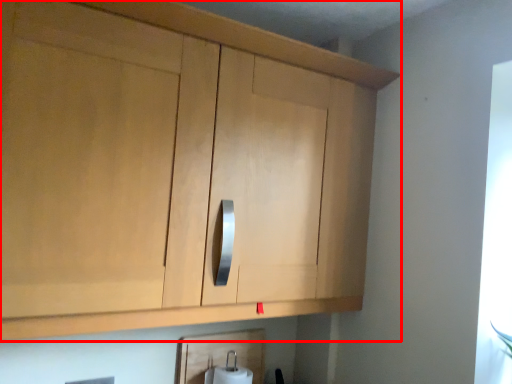
Question: From the image's perspective, considering the relative positions of cabinetry (annotated by the red box) and toilet paper in the image provided, where is cabinetry (annotated by the red box) located with respect to the staircase?

Choices:
 (A) above
 (B) below

Answer: (A)